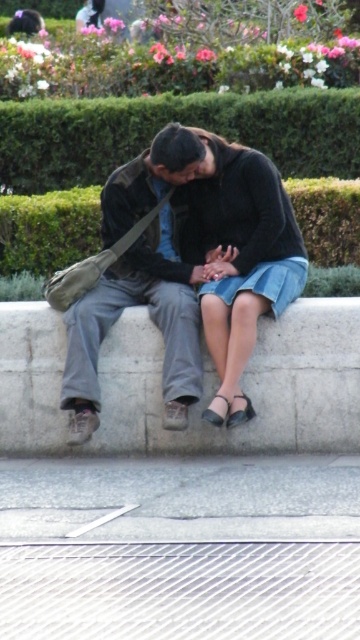
You are a photographer trying to capture a candid shot of the two people sitting on the wall. You notice the matte black jacket at center and the green leafy hedge at upper center. Which object is positioned to the right side of the other?

The matte black jacket at center is to the right of the green leafy hedge at upper center.

You are a photographer trying to capture a candid shot of the matte black jacket at center and the green leafy hedge at center. Based on their positions, which object is closer to the camera?

The matte black jacket at center is located below the green leafy hedge at center, so the green leafy hedge at center is closer to the camera.

You are a photographer trying to capture a candid shot of the matte black jacket at center and the green leafy hedge at center. Since you want the hedge to be in the background, which object should you position closer to the camera?

The matte black jacket at center should be positioned closer to the camera because it is already to the right of the green leafy hedge at center, so moving it forward would keep the hedge in the background.